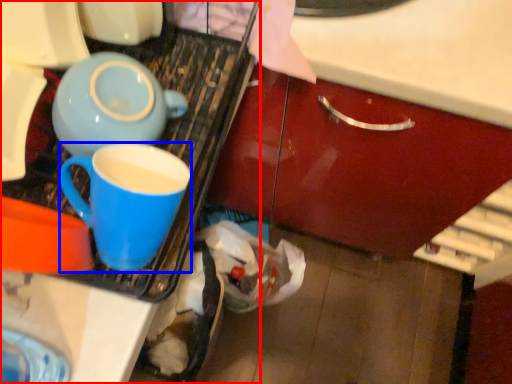
Question: Which of the following is the closest to the observer, appliance (highlighted by a red box) or coffee cup (highlighted by a blue box)?

Choices:
 (A) appliance
 (B) coffee cup

Answer: (B)